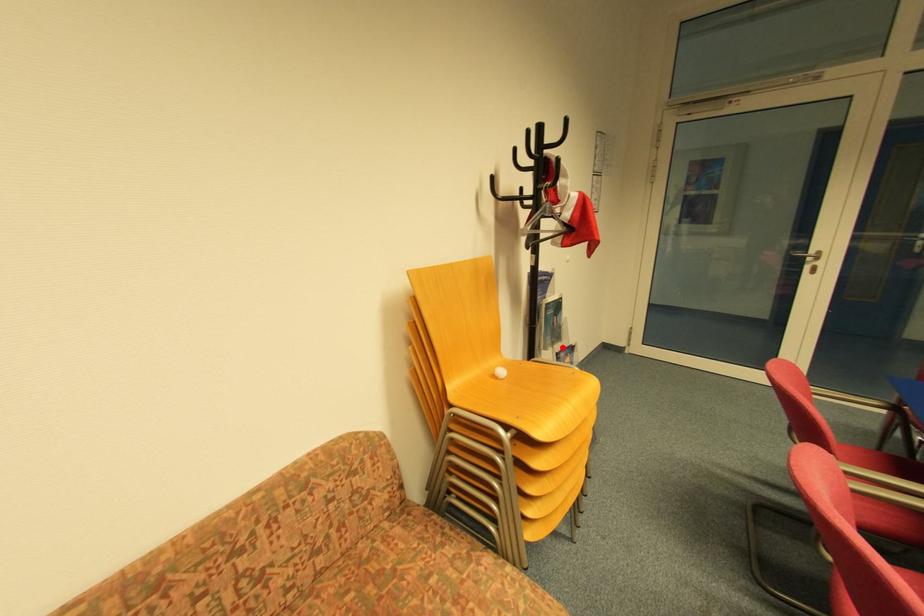
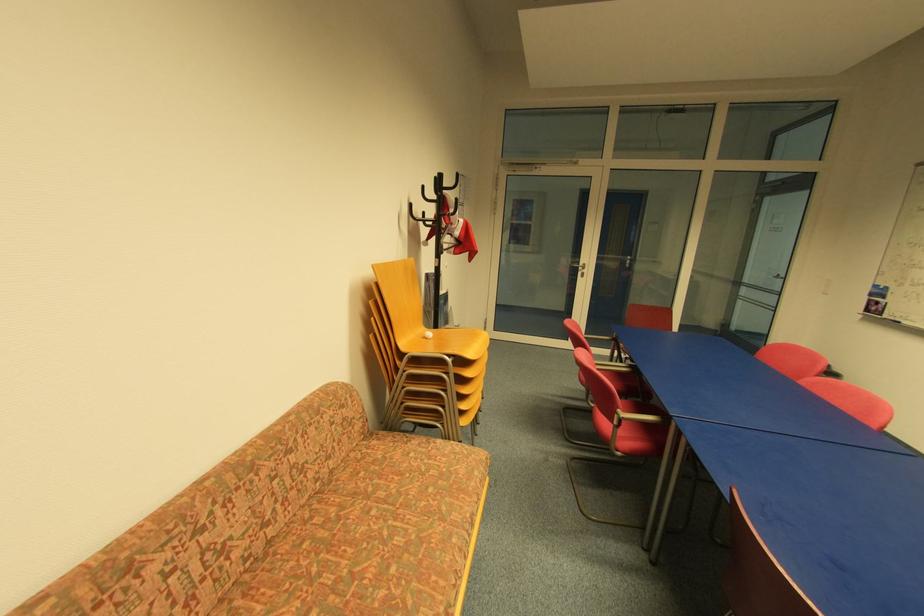
Locate, in the second image, the point that corresponds to the highlighted location in the first image.

(452, 329)